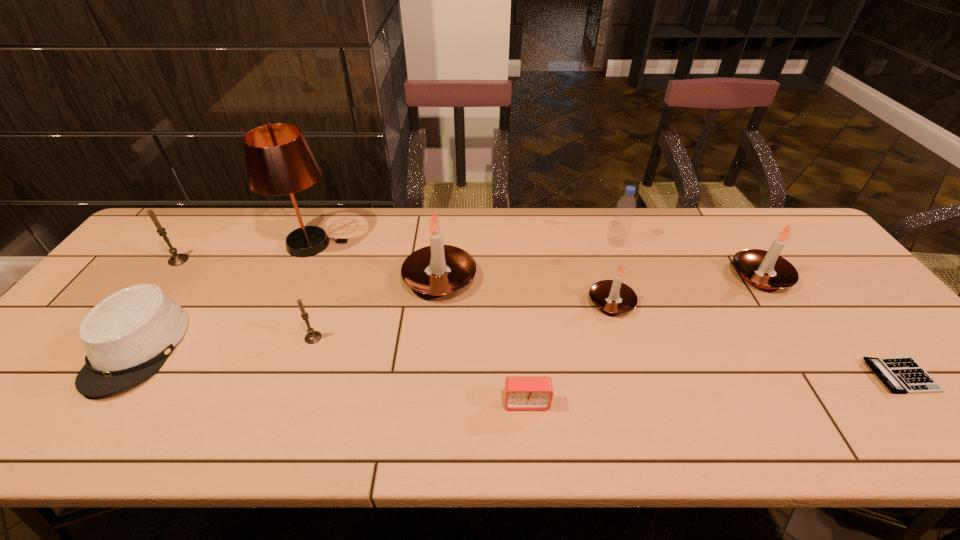
I want to click on the tallest object, so click(279, 161).

This screenshot has width=960, height=540. I want to click on the biggest white candle, so click(438, 269).

I want to click on the third candle from right to left, so click(x=438, y=269).

This screenshot has height=540, width=960. I want to click on blue bottle, so click(621, 224).

The height and width of the screenshot is (540, 960). What are the coordinates of `the second object from right to left` in the screenshot? It's located at (752, 264).

The height and width of the screenshot is (540, 960). In order to click on the second smallest white candle in this screenshot , I will do `click(752, 264)`.

Identify the location of the left gray candle. (177, 259).

Identify the location of the farther gray candle. (177, 259).

Find the location of a particular element. the smallest white candle is located at coordinates (602, 293).

The width and height of the screenshot is (960, 540). What are the coordinates of `the second candle from right to left` in the screenshot? It's located at (602, 293).